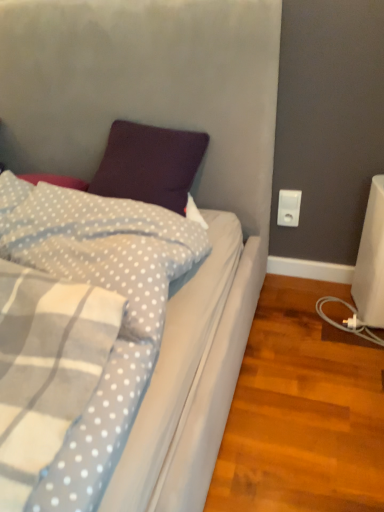
Question: Is point (281, 224) closer or farther from the camera than point (125, 202)?

Choices:
 (A) closer
 (B) farther

Answer: (B)

Question: In terms of size, does white plastic power plug at right appear bigger or smaller than light purple plush pillow at upper left?

Choices:
 (A) small
 (B) big

Answer: (A)

Question: Is white plastic power plug at right taller or shorter than light purple plush pillow at upper left?

Choices:
 (A) short
 (B) tall

Answer: (A)

Question: In the image, is light purple plush pillow at upper left on the left side or the right side of white plastic power plug at right?

Choices:
 (A) right
 (B) left

Answer: (B)

Question: Considering the positions of point (160, 306) and point (294, 225), is point (160, 306) closer or farther from the camera than point (294, 225)?

Choices:
 (A) farther
 (B) closer

Answer: (B)

Question: Looking at their shapes, would you say light purple plush pillow at upper left is wider or thinner than white plastic power plug at right?

Choices:
 (A) thin
 (B) wide

Answer: (B)

Question: From a real-world perspective, is light purple plush pillow at upper left above or below white plastic power plug at right?

Choices:
 (A) below
 (B) above

Answer: (B)